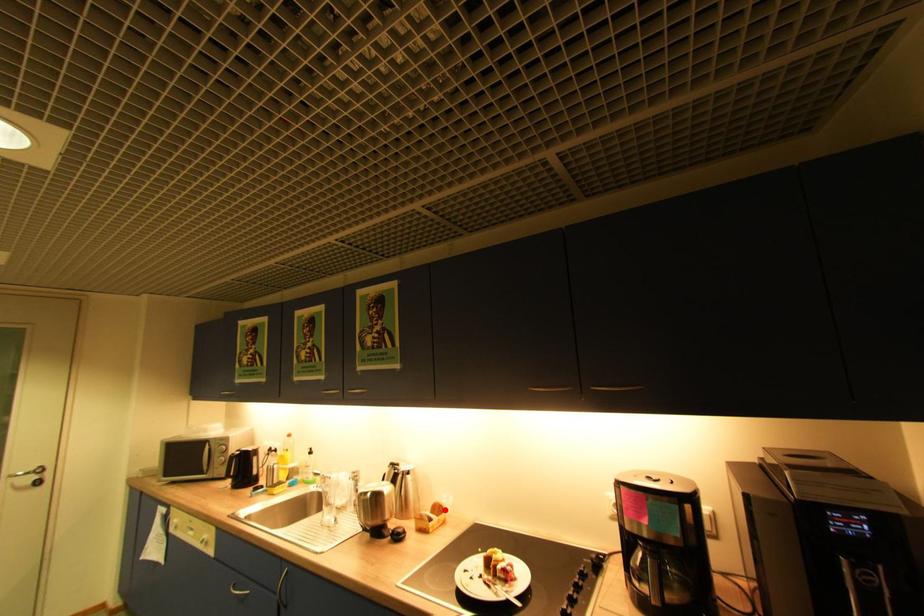
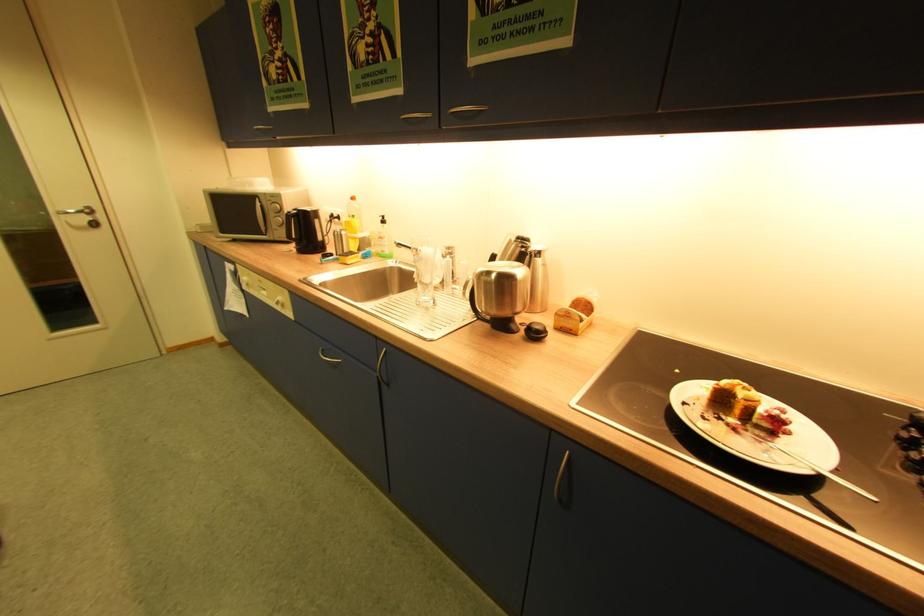
The point at the highlighted location is marked in the first image. Where is the corresponding point in the second image?

(590, 306)